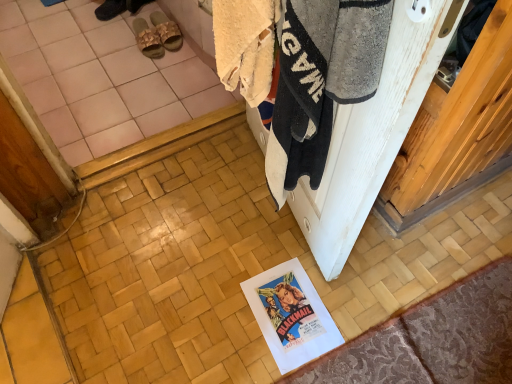
Where is `free space that is in between dark brown leather sandals at upper center, which is the 1th footwear in left-to-right order, and beige fabric slipper at upper left, which is counted as the second footwear, starting from the left`? This screenshot has width=512, height=384. free space that is in between dark brown leather sandals at upper center, which is the 1th footwear in left-to-right order, and beige fabric slipper at upper left, which is counted as the second footwear, starting from the left is located at coordinates click(123, 31).